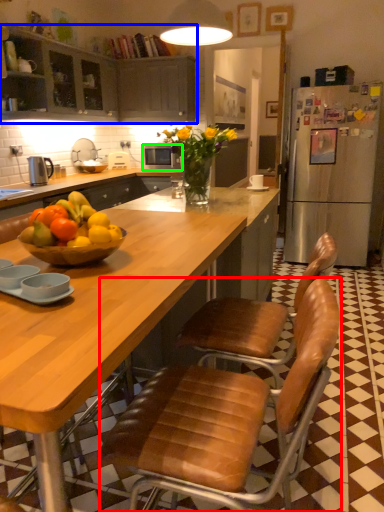
Question: Which object is positioned farthest from chair (highlighted by a red box)? Select from cabinetry (highlighted by a blue box) and microwave oven (highlighted by a green box).

Choices:
 (A) cabinetry
 (B) microwave oven

Answer: (B)